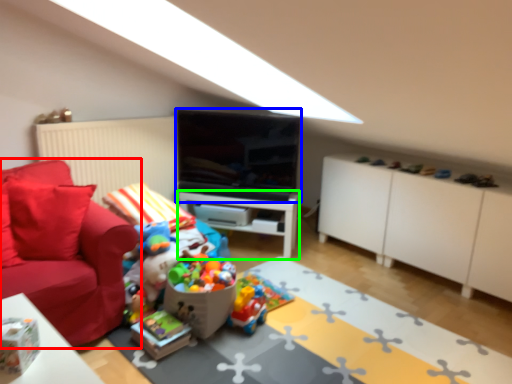
Question: Which is nearer to the studio couch (highlighted by a red box)? television (highlighted by a blue box) or table (highlighted by a green box).

Choices:
 (A) television
 (B) table

Answer: (A)